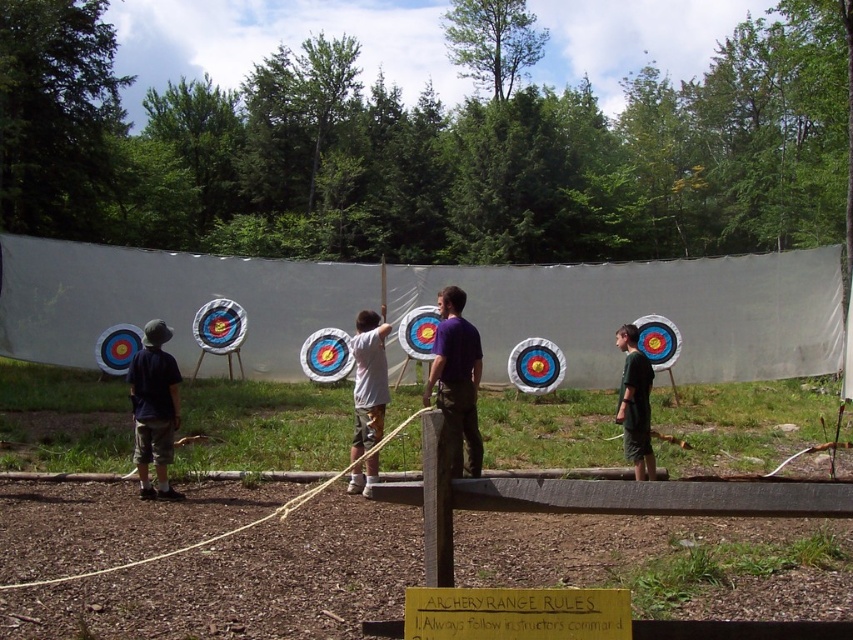
Can you confirm if purple cotton shirt at center is thinner than white cotton shirt at center?

No.

At what (x,y) coordinates should I click in order to perform the action: click on purple cotton shirt at center. Please return your answer as a coordinate pair (x, y). Looking at the image, I should click on (457, 380).

From the picture: Can you confirm if purple cotton shirt at center is taller than dark green shorts at center?

Yes, purple cotton shirt at center is taller than dark green shorts at center.

Does purple cotton shirt at center appear on the left side of dark green shorts at center?

Correct, you'll find purple cotton shirt at center to the left of dark green shorts at center.

Locate an element on the screen. purple cotton shirt at center is located at coordinates [457, 380].

Between white cotton shirt at center and dark green shorts at center, which one has more height?

white cotton shirt at center is taller.

Does white cotton shirt at center have a lesser width compared to dark green shorts at center?

No.

Who is more forward, (387, 326) or (625, 433)?

Point (387, 326) is more forward.

Find the location of a particular element. The height and width of the screenshot is (640, 853). white cotton shirt at center is located at coordinates (368, 381).